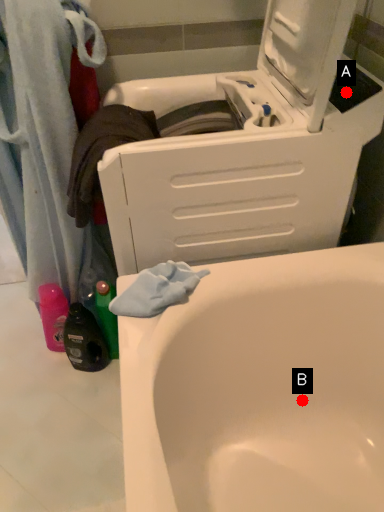
Question: Two points are circled on the image, labeled by A and B beside each circle. Among these points, which one is nearest to the camera?

Choices:
 (A) A is closer
 (B) B is closer

Answer: (A)